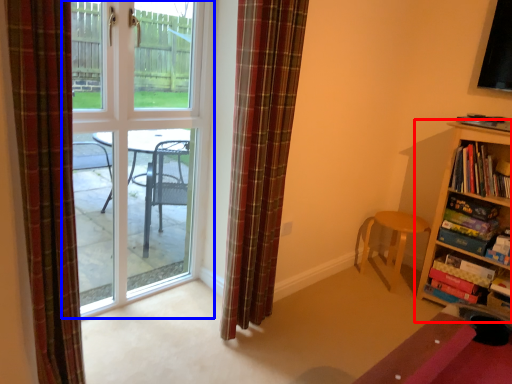
Question: Which of the following is the closest to the observer, bookcase (highlighted by a red box) or door (highlighted by a blue box)?

Choices:
 (A) bookcase
 (B) door

Answer: (B)